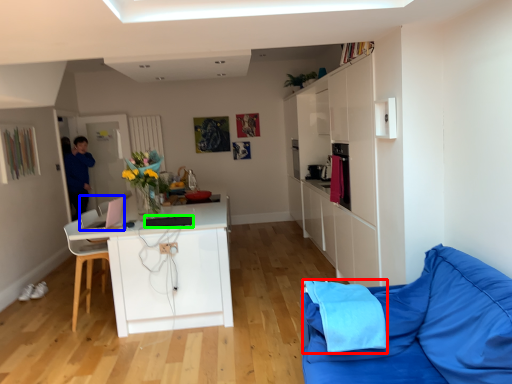
Question: Based on their relative distances, which object is nearer to material (highlighted by a red box)? Choose from appliance (highlighted by a blue box) and appliance (highlighted by a green box).

Choices:
 (A) appliance
 (B) appliance

Answer: (B)